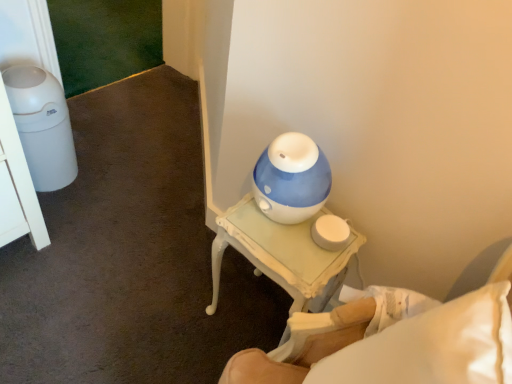
Question: From the image's perspective, is white painted wood table at center above or below white painted wood nightstand at lower right?

Choices:
 (A) below
 (B) above

Answer: (B)

Question: Is white painted wood table at center inside or outside of white painted wood nightstand at lower right?

Choices:
 (A) inside
 (B) outside

Answer: (B)

Question: Looking at the image, does white painted wood table at center seem bigger or smaller compared to white painted wood nightstand at lower right?

Choices:
 (A) big
 (B) small

Answer: (B)

Question: From a real-world perspective, is white painted wood nightstand at lower right positioned above or below white painted wood table at center?

Choices:
 (A) above
 (B) below

Answer: (A)

Question: From the image's perspective, relative to white painted wood table at center, is white painted wood nightstand at lower right above or below?

Choices:
 (A) above
 (B) below

Answer: (B)

Question: In terms of size, does white painted wood nightstand at lower right appear bigger or smaller than white painted wood table at center?

Choices:
 (A) small
 (B) big

Answer: (B)

Question: Is point (484, 329) positioned closer to the camera than point (257, 259)?

Choices:
 (A) closer
 (B) farther

Answer: (A)